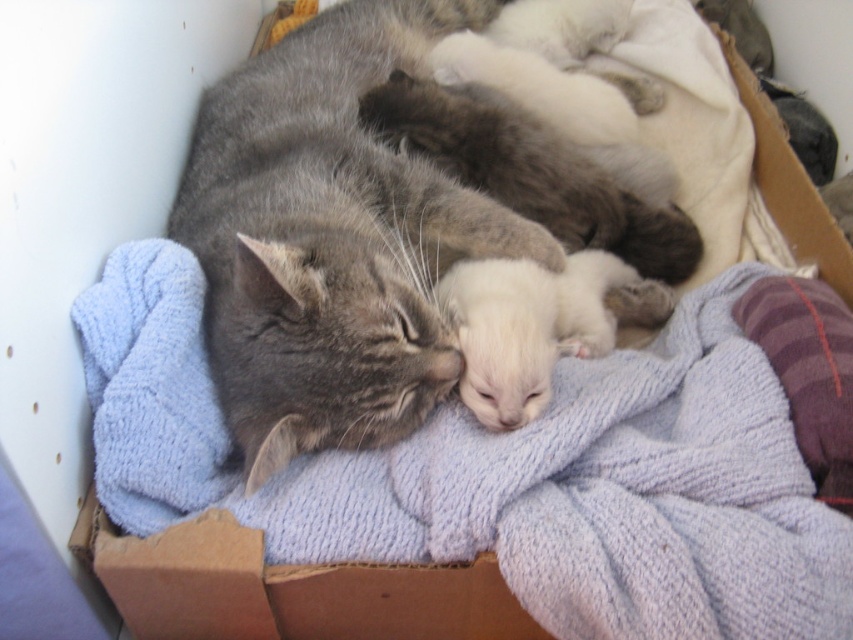
Between light blue knitted blanket at center and gray tabby cat at center, which one is positioned higher?

gray tabby cat at center is higher up.

This screenshot has width=853, height=640. Describe the element at coordinates (503, 472) in the screenshot. I see `light blue knitted blanket at center` at that location.

Does point (309, 544) lie in front of point (264, 80)?

Yes, point (309, 544) is closer to viewer.

The width and height of the screenshot is (853, 640). What are the coordinates of `light blue knitted blanket at center` in the screenshot? It's located at (503, 472).

Is gray tabby cat at center thinner than cardboard box at lower left?

No.

The width and height of the screenshot is (853, 640). Describe the element at coordinates (332, 237) in the screenshot. I see `gray tabby cat at center` at that location.

Locate an element on the screen. gray tabby cat at center is located at coordinates (332, 237).

Between light blue knitted blanket at center and white soft kitten at center, which one has more height?

With more height is light blue knitted blanket at center.

Who is positioned more to the left, light blue knitted blanket at center or white soft kitten at center?

light blue knitted blanket at center is more to the left.

Who is more forward, (442,454) or (492,365)?

Point (442,454) is more forward.

Locate an element on the screen. The width and height of the screenshot is (853, 640). light blue knitted blanket at center is located at coordinates (503, 472).